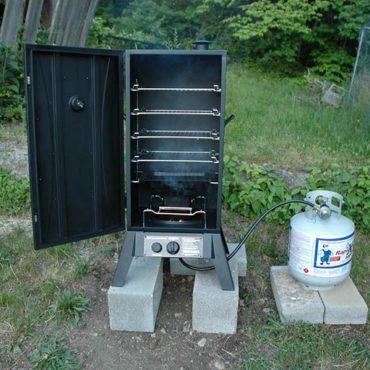
Find the location of a particular element. This screenshot has height=370, width=370. door of smoker, open to left is located at coordinates (80, 174).